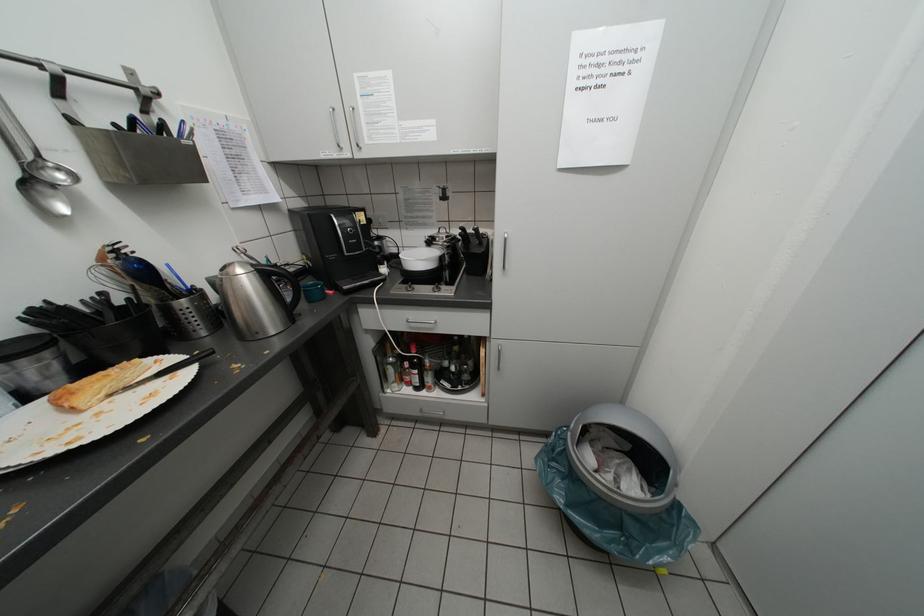
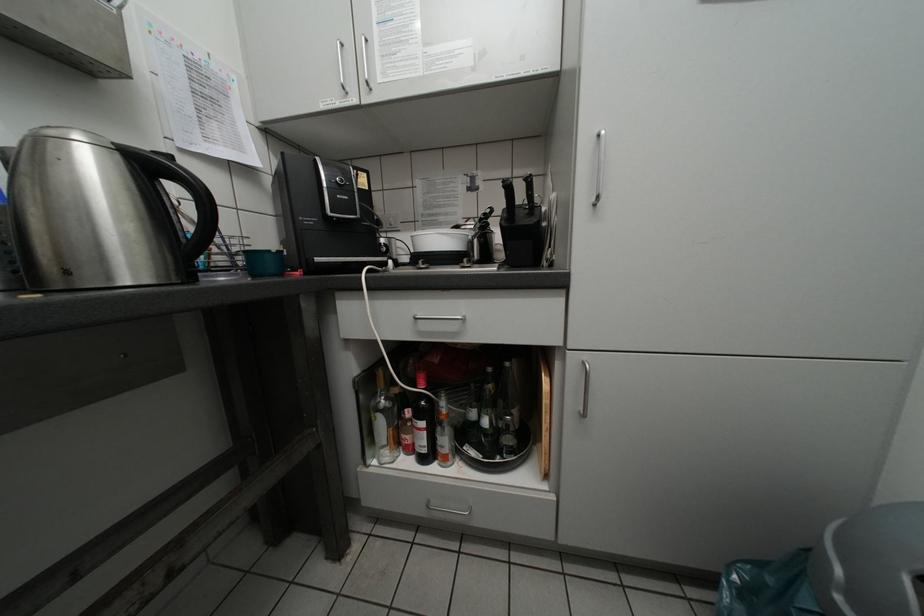
Question: The images are taken continuously from a first-person perspective. In which direction are you moving?

Choices:
 (A) Left
 (B) Right
 (C) Forward
 (D) Backward

Answer: (C)